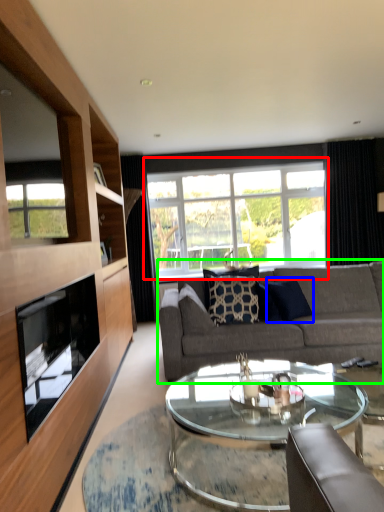
Question: Which object is positioned farthest from window (highlighted by a red box)? Select from pillow (highlighted by a blue box) and studio couch (highlighted by a green box).

Choices:
 (A) pillow
 (B) studio couch

Answer: (B)